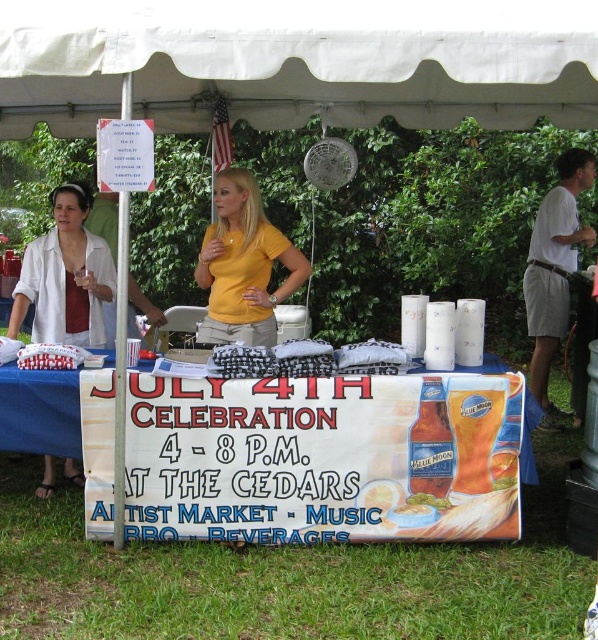
Question: Among these points, which one is nearest to the camera?

Choices:
 (A) (266, 88)
 (B) (93, 241)
 (C) (249, 232)

Answer: (C)

Question: Which point is farther to the camera?

Choices:
 (A) (x=545, y=81)
 (B) (x=291, y=291)

Answer: (B)

Question: Can you confirm if matte white blouse at left is bigger than white cotton shirt at upper right?

Choices:
 (A) no
 (B) yes

Answer: (A)

Question: Which point is farther from the camera taking this photo?

Choices:
 (A) (425, 500)
 (B) (572, 96)

Answer: (B)

Question: Does blue paperboard sign at center lie behind white cotton shirt at upper right?

Choices:
 (A) yes
 (B) no

Answer: (B)

Question: Does white fabric canopy at upper center come behind white cotton shirt at upper right?

Choices:
 (A) yes
 (B) no

Answer: (B)